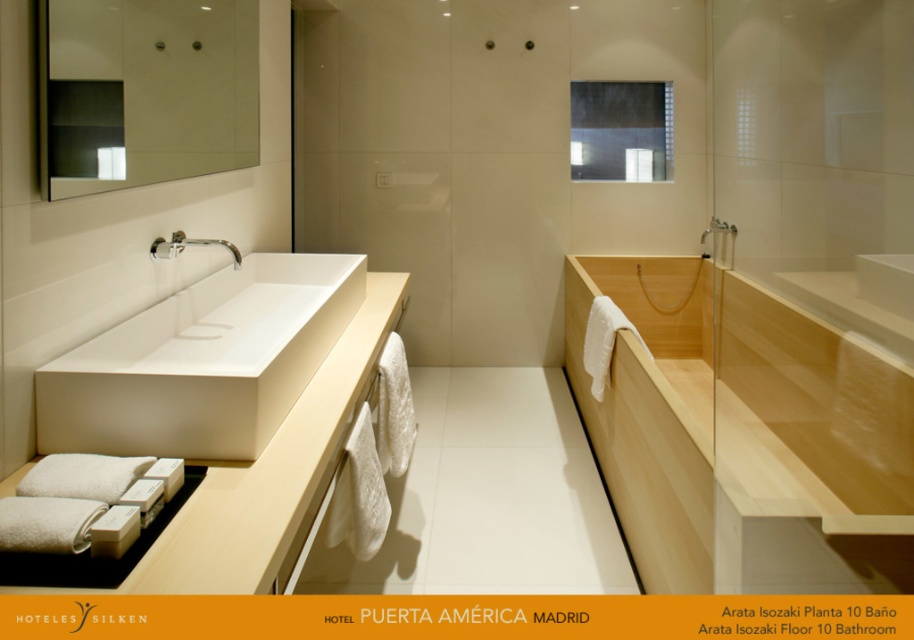
Can you confirm if natural wood bathtub at center is smaller than white glossy sink at left?

Incorrect, natural wood bathtub at center is not smaller in size than white glossy sink at left.

In order to click on natural wood bathtub at center in this screenshot , I will do `click(742, 436)`.

Between point (266, 403) and point (284, 566), which one is positioned in front?

Point (284, 566) is more forward.

Does white glossy sink at left lie in front of white matte sink at center?

No, it is behind white matte sink at center.

Describe the element at coordinates (202, 362) in the screenshot. The image size is (914, 640). I see `white glossy sink at left` at that location.

You are a GUI agent. You are given a task and a screenshot of the screen. Output one action in this format:
    pyautogui.click(x=<x>, y=<y>)
    Task: Click on the white glossy sink at left
    The width and height of the screenshot is (914, 640).
    Given the screenshot: What is the action you would take?
    coord(202,362)

Between natural wood bathtub at center and white matte sink at center, which one has more height?

natural wood bathtub at center

Is natural wood bathtub at center bigger than white matte sink at center?

Yes, natural wood bathtub at center is bigger than white matte sink at center.

Between point (590, 284) and point (179, 515), which one is positioned in front?

Point (179, 515)

The height and width of the screenshot is (640, 914). I want to click on natural wood bathtub at center, so click(742, 436).